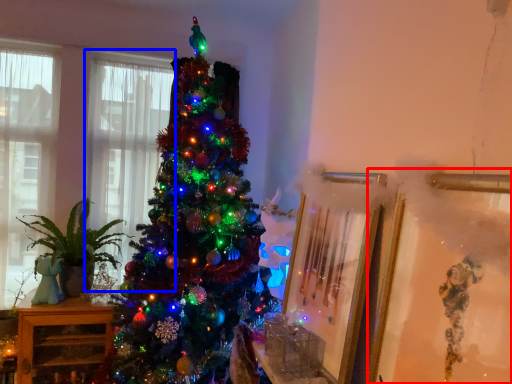
Question: Which object is further to the camera taking this photo, picture frame (highlighted by a red box) or window (highlighted by a blue box)?

Choices:
 (A) picture frame
 (B) window

Answer: (B)